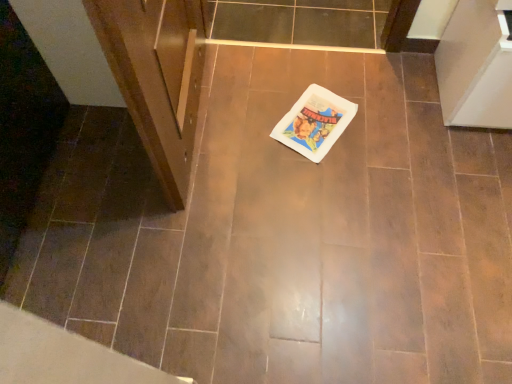
Locate an element on the screen. vacant area situated to the left side of white glossy cabinet at right is located at coordinates (394, 108).